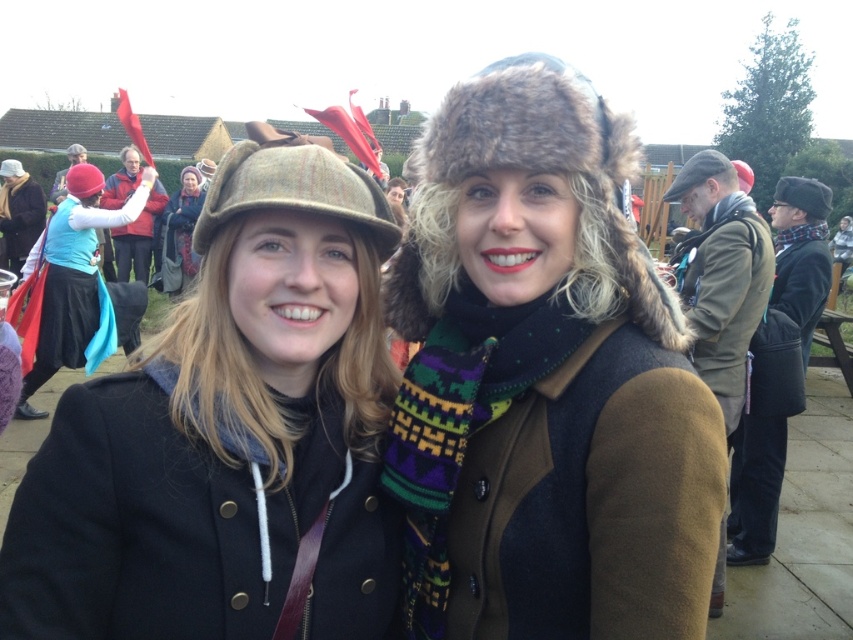
You are a photographer trying to capture a closeup shot of the knitted woolen hat at upper left. Given that your camera has a maximum zoom range of 12 meters, will you be able to focus on the hat?

The knitted woolen hat at upper left is 14.00 meters away from the camera, which exceeds the camera maximum zoom range of 12 meters. Therefore, you cannot focus on the hat.

You are taking a photo of the two points in the image. Which point, point [178,278] or point [83,180], will appear closer to the top of the photo?

Point [178,278] is further to the camera than point [83,180], so it will appear closer to the top of the photo.

You are a photographer standing 10 meters away from the knitted woolen hat at upper left and red fabric hat at upper left. You want to take a photo that includes both hats in the frame. Given that your camera has a maximum zoom range of 10 meters, can you capture both hats in a single shot without moving closer?

The distance between the knitted woolen hat at upper left and red fabric hat at upper left is 5.35 meters. Since your camera can zoom up to 10 meters and you are 10 meters away, the 5.35 meter separation between the hats is within the camera range. Therefore, you can capture both hats in a single shot without moving closer.